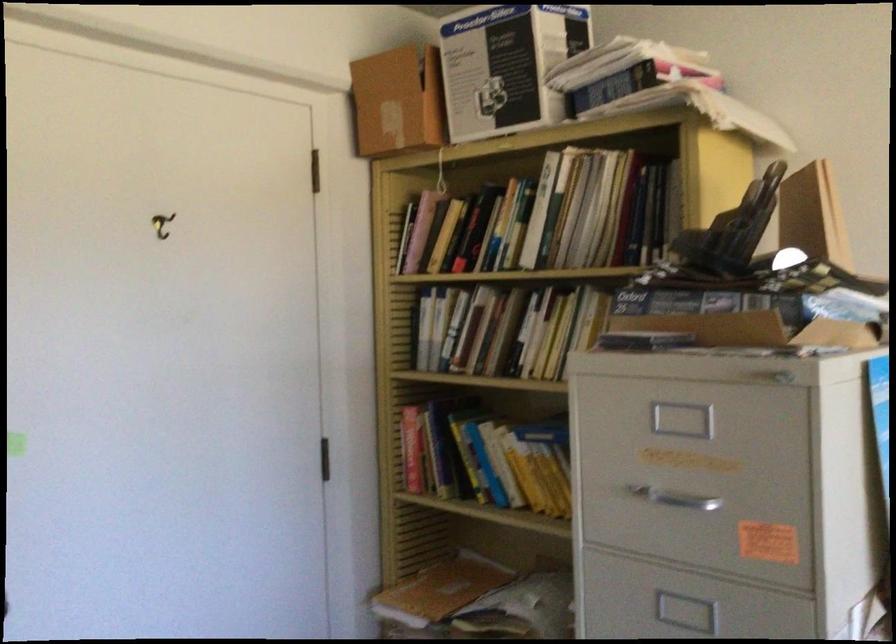
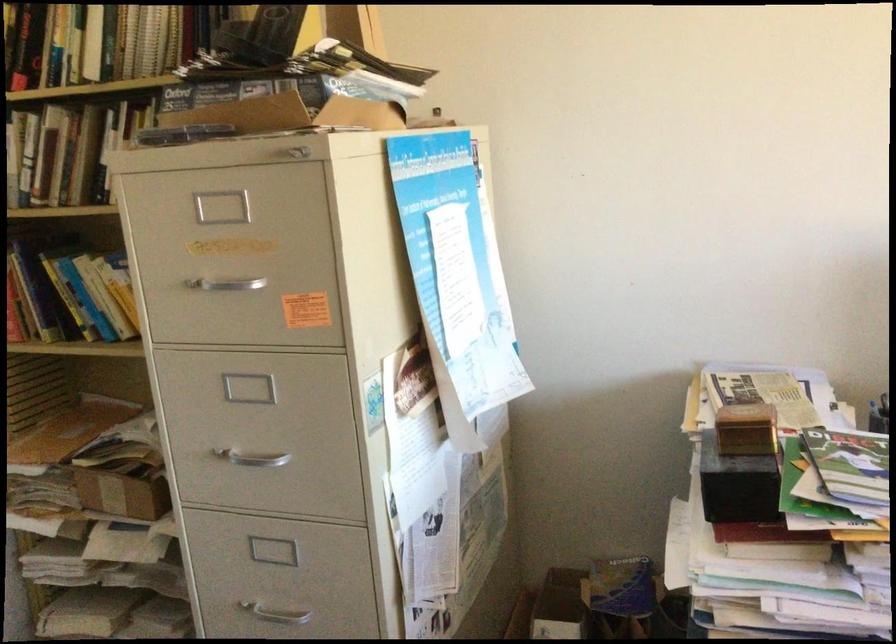
The point at (510, 335) is marked in the first image. Where is the corresponding point in the second image?

(83, 156)